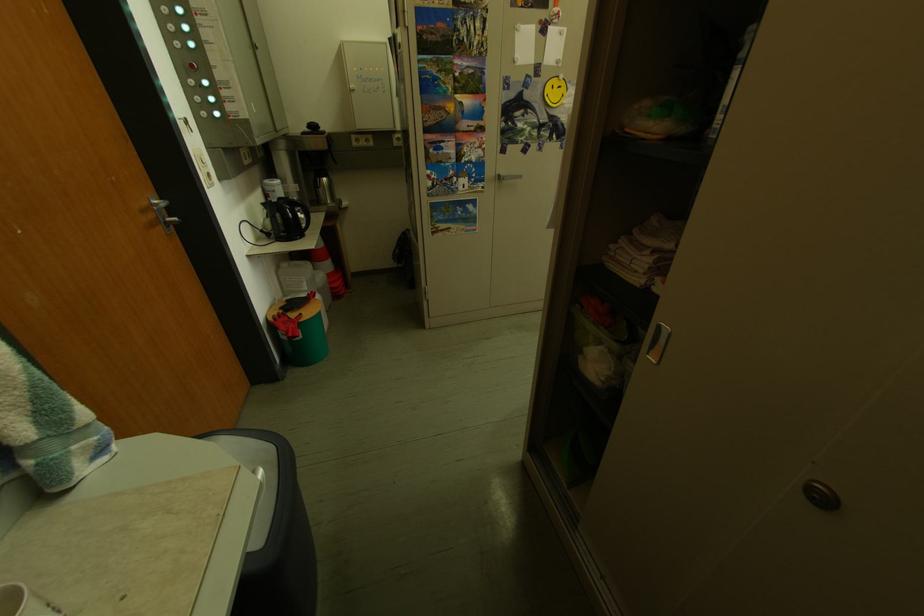
What do you see at coordinates (821, 495) in the screenshot?
I see `the round cabinet lock` at bounding box center [821, 495].